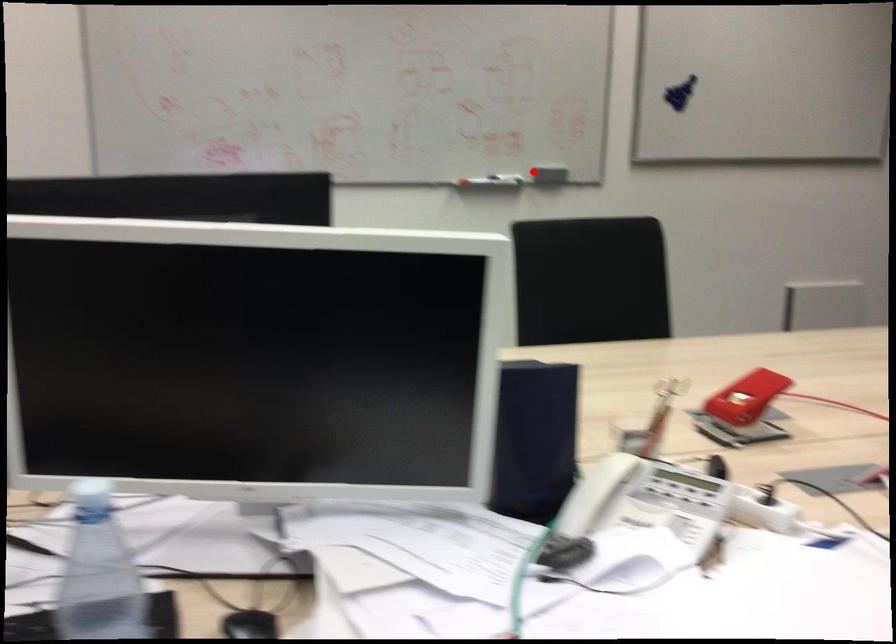
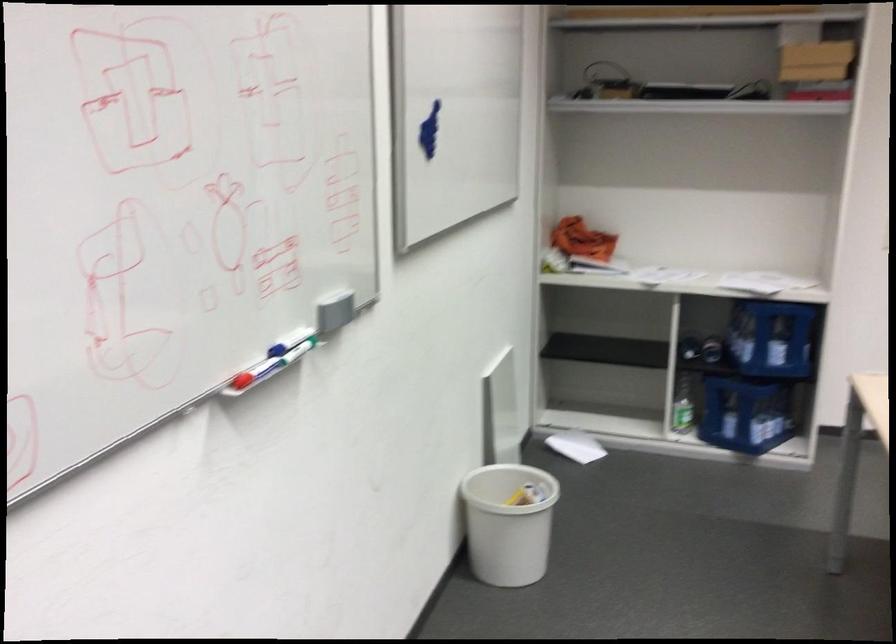
Find the pixel in the second image that matches the highlighted location in the first image.

(293, 355)